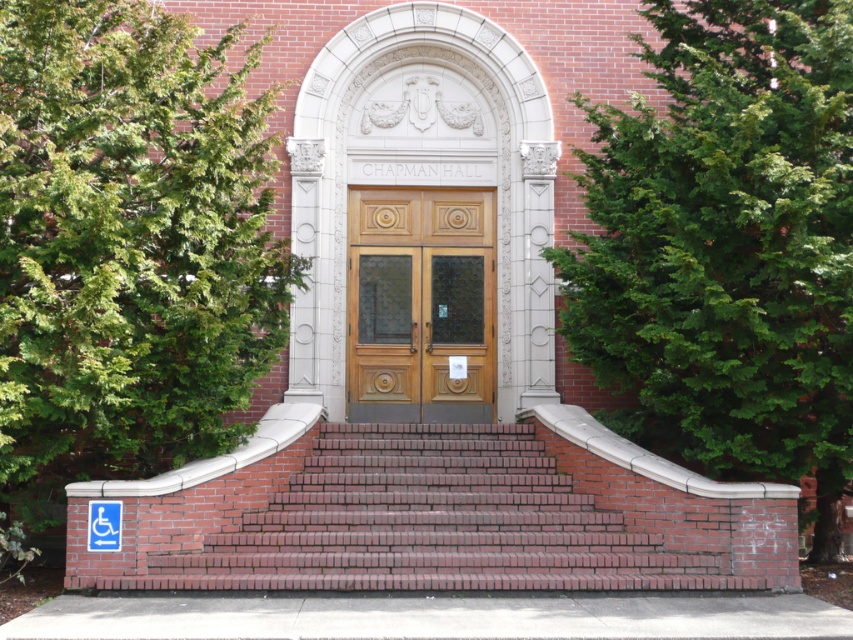
Question: Among these objects, which one is farthest from the camera?

Choices:
 (A) brick stairs at center
 (B) wooden door at center
 (C) green leafy tree at left
 (D) green leafy tree at upper right

Answer: (B)

Question: Which point is closer to the camera?

Choices:
 (A) green leafy tree at upper right
 (B) brick stairs at center

Answer: (A)

Question: Is green leafy tree at upper right positioned before wooden door at center?

Choices:
 (A) no
 (B) yes

Answer: (B)

Question: Considering the relative positions of green leafy tree at left and brick stairs at center in the image provided, where is green leafy tree at left located with respect to brick stairs at center?

Choices:
 (A) right
 (B) left

Answer: (B)

Question: Is green leafy tree at left smaller than brick stairs at center?

Choices:
 (A) no
 (B) yes

Answer: (A)

Question: Which object appears closest to the camera in this image?

Choices:
 (A) green leafy tree at upper right
 (B) wooden door at center
 (C) brick stairs at center

Answer: (A)